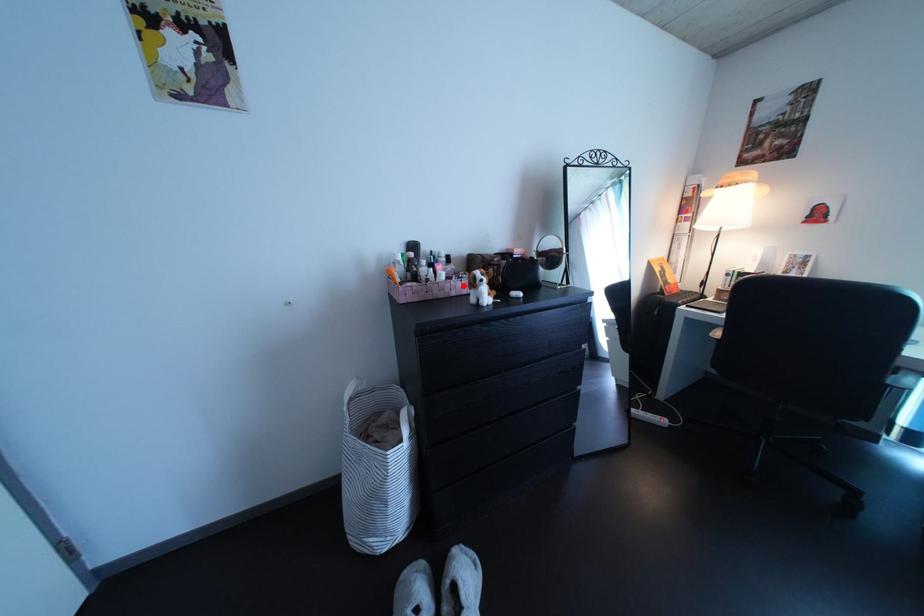
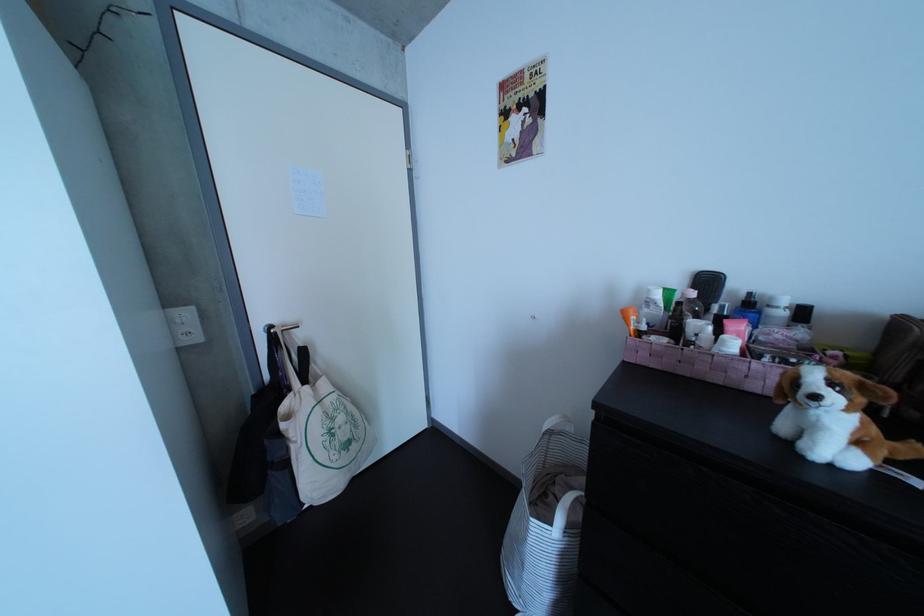
The point at the highlighted location is marked in the first image. Where is the corresponding point in the second image?

(764, 362)